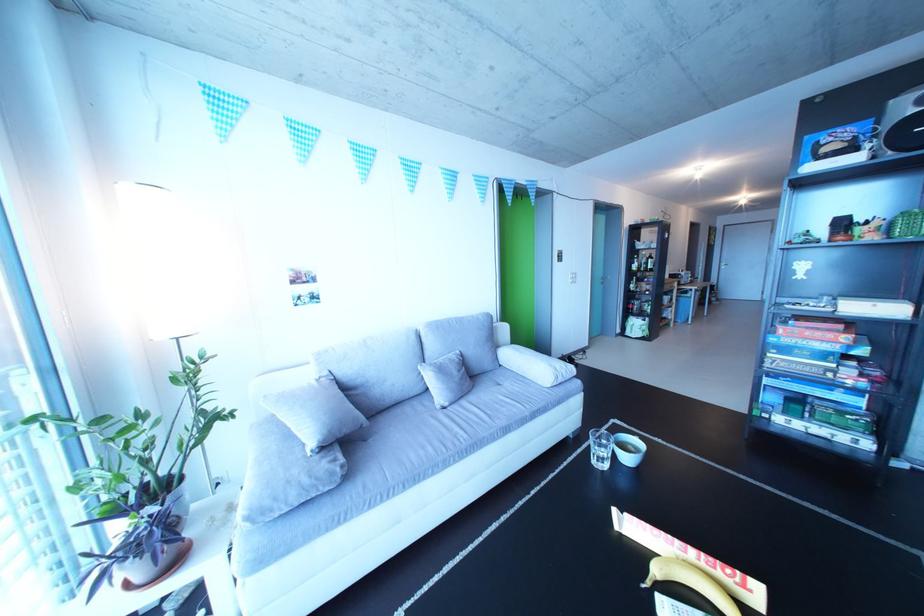
Find the location of a particular element. The width and height of the screenshot is (924, 616). sofa sitting surface is located at coordinates (337, 398).